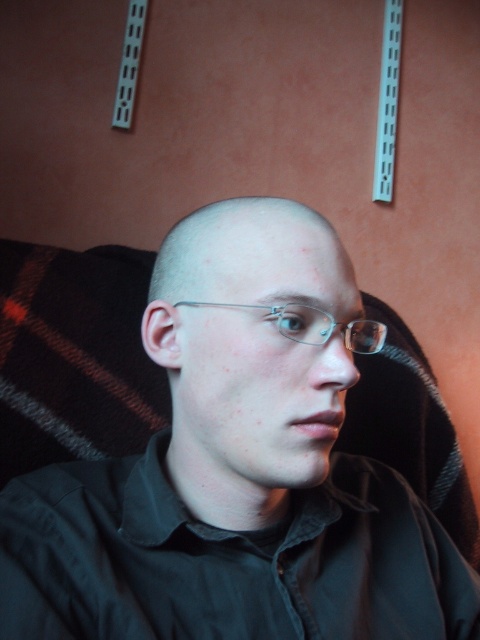
You are an artist trying to draw this scene. You need to determine which of the two points, point [157,625] or point [348,332], should be placed closer to the front of your drawing. Based on the image, which point should you position closer to the viewer?

Point [157,625] is closer to the viewer than point [348,332], so you should position point [157,625] closer to the front of your drawing.

You are a photographer adjusting your camera settings. You need to focus on a point that is exactly 50 centimeters away from the viewer. Is the point at coordinates point (217, 508) within the acceptable range for your focus? Assume the acceptable range is plus or minus 0.5 centimeters.

The distance of point (217, 508) from viewer is 50.29 centimeters. Since the acceptable range is 49.5 to 50.5 centimeters, the point is slightly outside the acceptable range by 0.29 centimeters.

You are a optometrist examining two pairs of glasses on a patient. You notice the matte black glasses at center and the clear plastic glasses at center. Which pair is positioned lower on the patient?

The matte black glasses at center is below clear plastic glasses at center, so the matte black glasses at center is positioned lower on the patient.